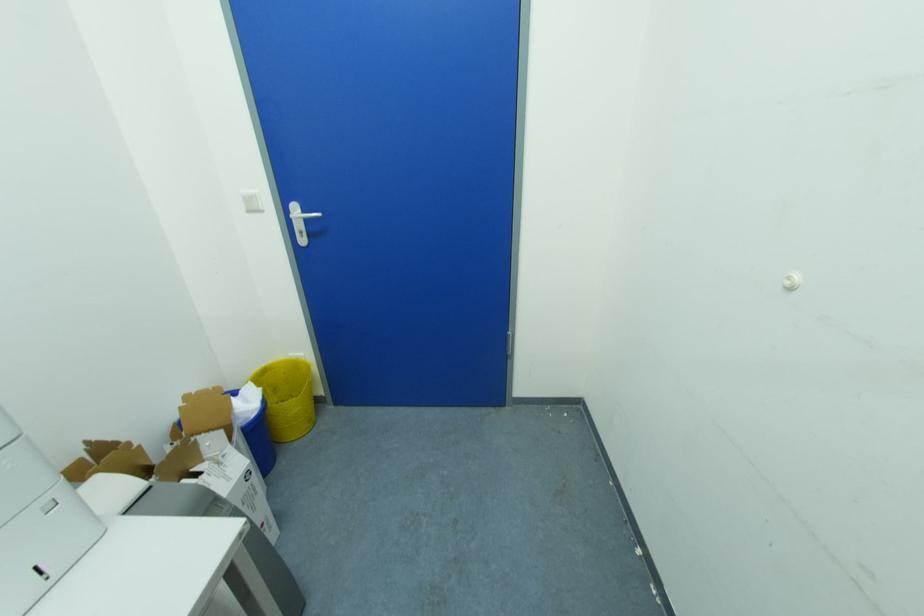
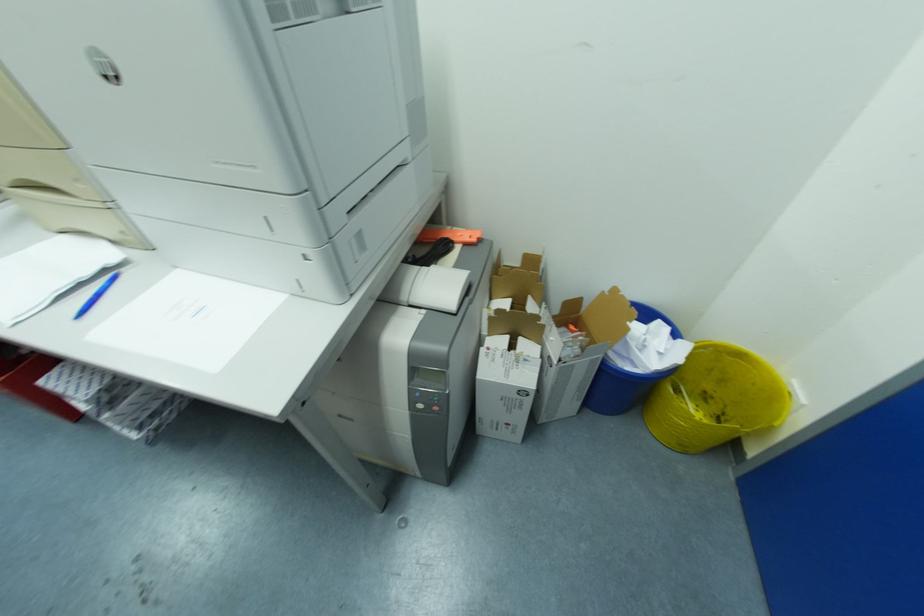
The first image is from the beginning of the video and the second image is from the end. How did the camera likely rotate when shooting the video?

The rotation direction of the camera is left-down.